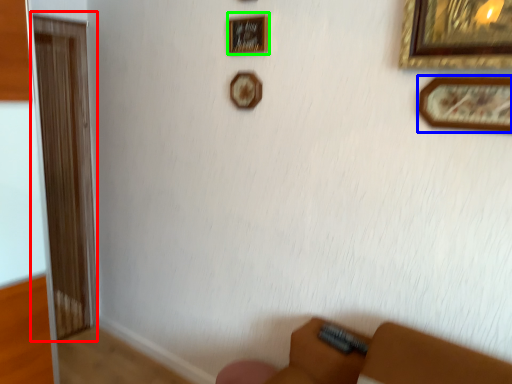
Question: Considering the real-world distances, which object is farthest from screen door (highlighted by a red box)? picture frame (highlighted by a blue box) or picture frame (highlighted by a green box)?

Choices:
 (A) picture frame
 (B) picture frame

Answer: (A)